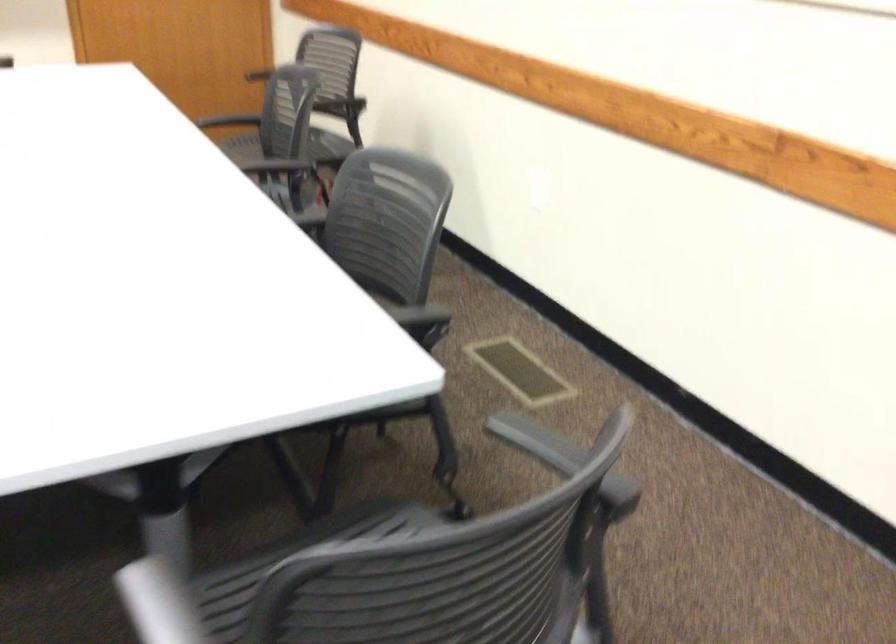
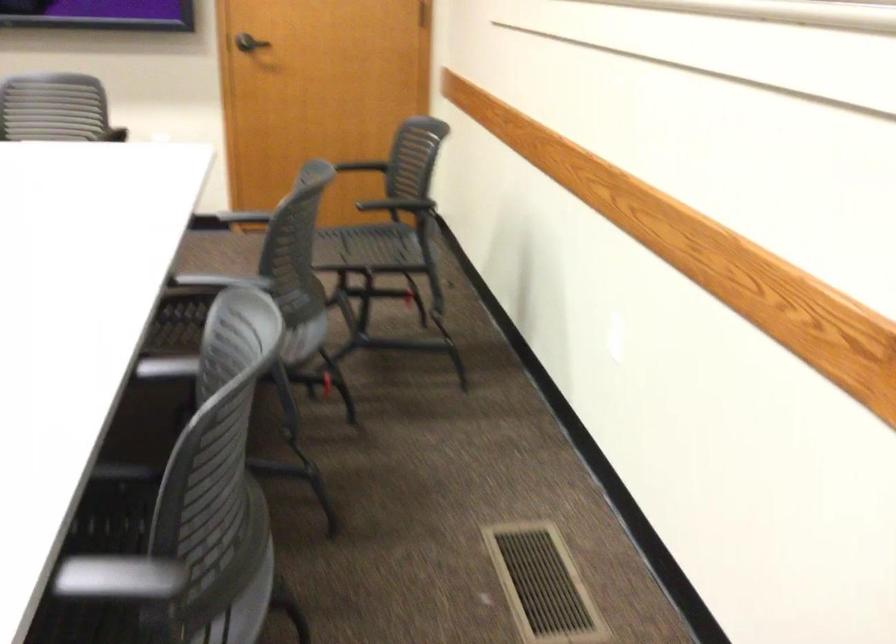
In the second image, find the point that corresponds to (349,176) in the first image.

(225, 319)